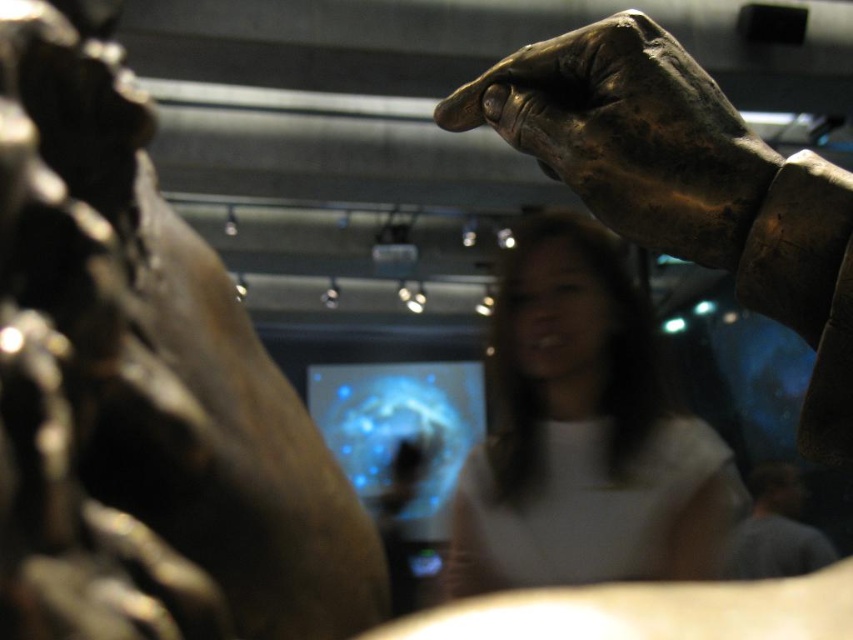
Question: Which of the following is the farthest from the observer?

Choices:
 (A) (534, 227)
 (B) (672, 120)
 (C) (97, 620)

Answer: (A)

Question: Is shiny bronze statue at upper left behind white matte shirt at center?

Choices:
 (A) no
 (B) yes

Answer: (A)

Question: Which of these objects is positioned farthest from the bronze textured hand at upper right?

Choices:
 (A) white matte shirt at center
 (B) shiny bronze statue at upper left

Answer: (A)

Question: Is shiny bronze statue at upper left behind white matte shirt at center?

Choices:
 (A) yes
 (B) no

Answer: (B)

Question: Is shiny bronze statue at upper left to the right of white matte shirt at center from the viewer's perspective?

Choices:
 (A) yes
 (B) no

Answer: (B)

Question: Which of the following is the farthest from the observer?

Choices:
 (A) (67, 308)
 (B) (672, 61)
 (C) (679, 456)

Answer: (C)